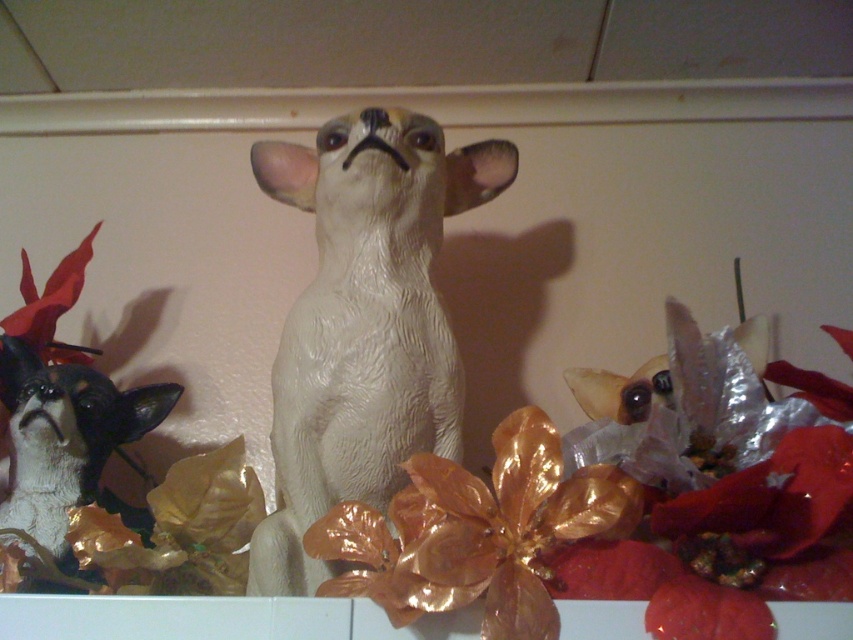
You are arranging a shelf and want to place the white glossy dog at center and the white glossy dog at left. Which one should you place first if you want the taller figurine to be at the back?

You should place the white glossy dog at left first because the white glossy dog at center is taller and should be placed at the back.

You are a photographer standing at a certain distance from the white glossy dog at center. You want to take a closeup photo of it. The camera requires a minimum distance of 30 inches to focus properly. Will you need to move closer or farther away to achieve focus?

The distance between you and the white glossy dog at center is 29.47 inches, which is less than the required 30 inches for proper focus. Therefore, you need to move slightly farther away to reach the minimum focusing distance.

You are arranging a shelf display and need to place the white glossy dog at center and the white glossy dog at left. Which one should you place first to ensure proper spacing?

You should place the white glossy dog at center first because it is larger than the white glossy dog at left, ensuring there is enough space for both.